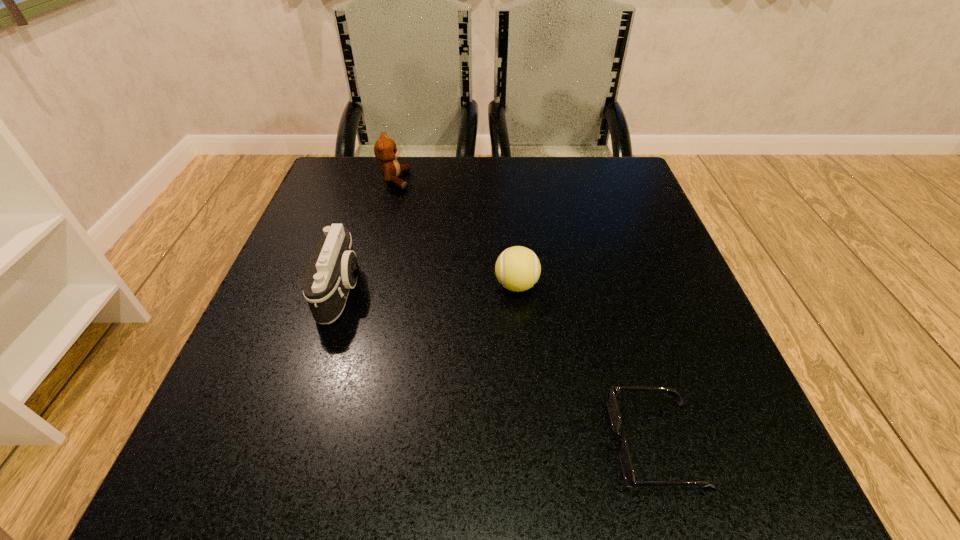
Locate an element on the screen. free space located 0.300m on the front-facing side of the nearest object is located at coordinates (391, 443).

The image size is (960, 540). In order to click on vacant space located 0.370m on the front-facing side of the nearest object in this screenshot , I will do `click(339, 443)`.

Where is `object that is at the far edge`? Image resolution: width=960 pixels, height=540 pixels. object that is at the far edge is located at coordinates (385, 150).

The width and height of the screenshot is (960, 540). I want to click on object at the near edge, so click(x=625, y=460).

The width and height of the screenshot is (960, 540). In order to click on teddy bear that is positioned at the left edge in this screenshot , I will do `click(385, 150)`.

You are a GUI agent. You are given a task and a screenshot of the screen. Output one action in this format:
    pyautogui.click(x=<x>, y=<y>)
    Task: Click on the camera present at the left edge
    Image resolution: width=960 pixels, height=540 pixels.
    Given the screenshot: What is the action you would take?
    pyautogui.click(x=333, y=270)

At what (x,y) coordinates should I click in order to perform the action: click on object located in the right edge section of the desktop. Please return your answer as a coordinate pair (x, y). The height and width of the screenshot is (540, 960). Looking at the image, I should click on (625, 460).

Find the location of a particular element. object that is at the far left corner is located at coordinates (385, 150).

You are a GUI agent. You are given a task and a screenshot of the screen. Output one action in this format:
    pyautogui.click(x=<x>, y=<y>)
    Task: Click on the object located at the near right corner
    The height and width of the screenshot is (540, 960).
    Given the screenshot: What is the action you would take?
    pyautogui.click(x=625, y=460)

This screenshot has height=540, width=960. Find the location of `blank area at the far edge`. blank area at the far edge is located at coordinates (479, 165).